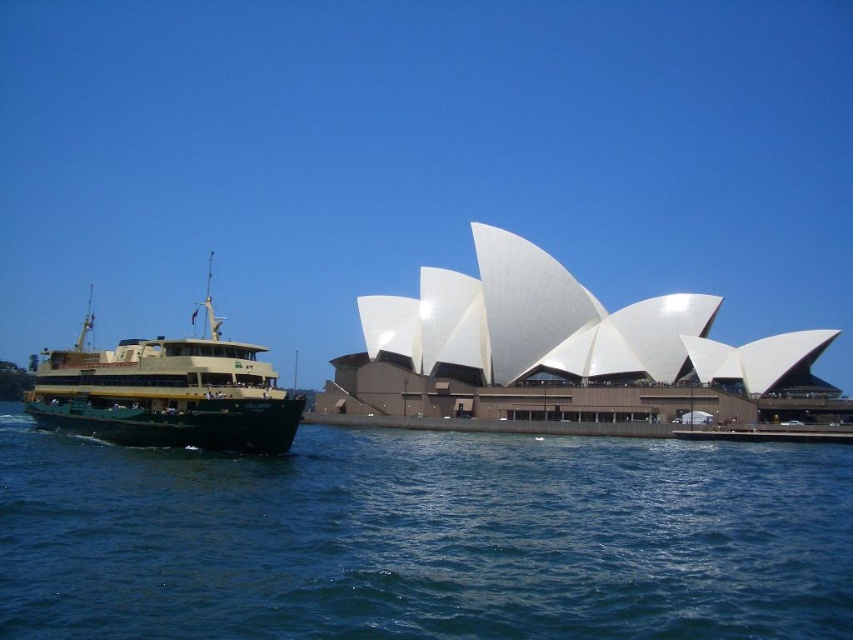
Question: Can you confirm if blue water at lower left is positioned to the left of green matte/yellow ferry at left?

Choices:
 (A) no
 (B) yes

Answer: (A)

Question: Is blue water at lower left bigger than green matte/yellow ferry at left?

Choices:
 (A) yes
 (B) no

Answer: (B)

Question: Does blue water at lower left appear on the left side of green matte/yellow ferry at left?

Choices:
 (A) yes
 (B) no

Answer: (B)

Question: Which of the following is the closest to the observer?

Choices:
 (A) (183, 442)
 (B) (664, 500)

Answer: (B)